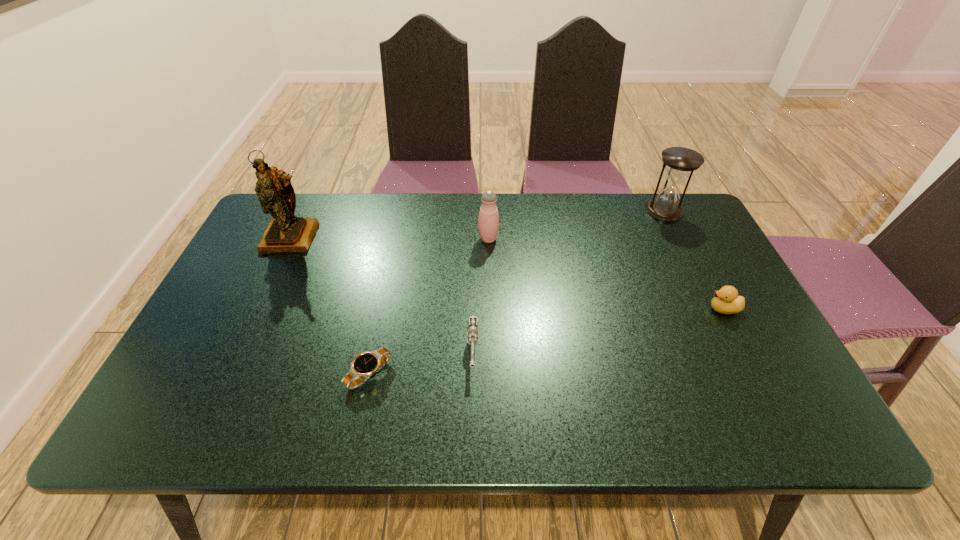
Image resolution: width=960 pixels, height=540 pixels. Identify the location of hourglass located in the right edge section of the desktop. (680, 162).

Locate an element on the screen. duckling positioned at the right edge is located at coordinates (726, 300).

Locate an element on the screen. object located in the far left corner section of the desktop is located at coordinates (285, 233).

Find the location of a particular element. The image size is (960, 540). object located in the far right corner section of the desktop is located at coordinates tap(680, 162).

The image size is (960, 540). What are the coordinates of `free space at the far edge` in the screenshot? It's located at (568, 215).

The height and width of the screenshot is (540, 960). Find the location of `free space at the left edge of the desktop`. free space at the left edge of the desktop is located at coordinates (235, 369).

At what (x,y) coordinates should I click in order to perform the action: click on blank area at the right edge. Please return your answer as a coordinate pair (x, y). Looking at the image, I should click on (737, 335).

You are a GUI agent. You are given a task and a screenshot of the screen. Output one action in this format:
    pyautogui.click(x=<x>, y=<y>)
    Task: Click on the vacant space at the far left corner of the desktop
    The image size is (960, 540).
    Given the screenshot: What is the action you would take?
    pyautogui.click(x=306, y=208)

You are a GUI agent. You are given a task and a screenshot of the screen. Output one action in this format:
    pyautogui.click(x=<x>, y=<y>)
    Task: Click on the free space at the near right corner of the desktop
    Image resolution: width=960 pixels, height=540 pixels.
    Given the screenshot: What is the action you would take?
    pyautogui.click(x=732, y=409)

I want to click on free space between the fourth farthest object and the thermos bottle, so click(x=606, y=274).